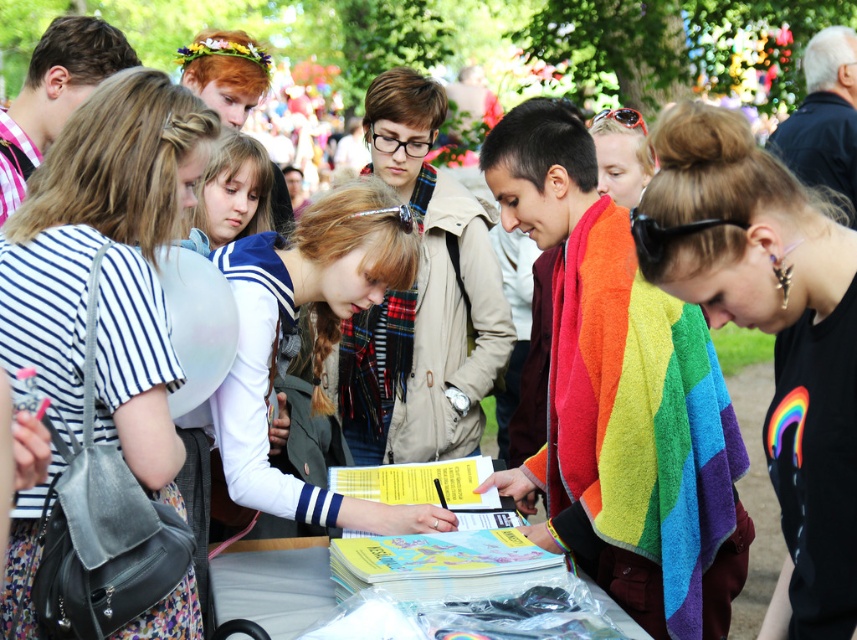
Who is positioned more to the right, rainbow towel at center or white plastic table at center?

rainbow towel at center

From the picture: Measure the distance between rainbow towel at center and camera.

A distance of 2.66 meters exists between rainbow towel at center and camera.

This screenshot has height=640, width=857. I want to click on rainbow towel at center, so click(x=621, y=397).

Which is more to the right, white sailor uniform at center or yellow paper book at center?

yellow paper book at center is more to the right.

Is white sailor uniform at center positioned at the back of yellow paper book at center?

That is True.

The image size is (857, 640). In order to click on white sailor uniform at center in this screenshot , I will do `click(313, 342)`.

Locate an element on the screen. This screenshot has height=640, width=857. white sailor uniform at center is located at coordinates (313, 342).

Is point (660, 417) closer to viewer compared to point (382, 557)?

No, it is not.

Find the location of a particular element. The height and width of the screenshot is (640, 857). rainbow towel at center is located at coordinates (621, 397).